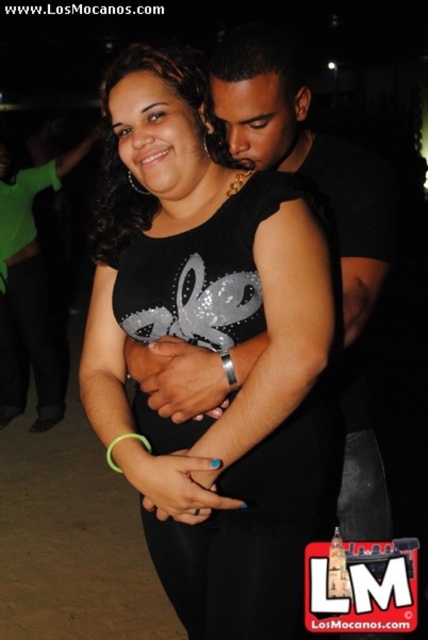
Which of these two, black sequined dress at center or black matte shirt at upper right, stands taller?

With more height is black sequined dress at center.

Can you confirm if black sequined dress at center is taller than black matte shirt at upper right?

Yes.

Between point (199, 256) and point (338, 177), which one is positioned in front?

Point (199, 256) is more forward.

Identify the location of black sequined dress at center. (210, 348).

Between black sequined dress at center and green matte shirt at left, which one is positioned higher?

Positioned higher is green matte shirt at left.

Which is in front, point (157, 522) or point (0, 243)?

Positioned in front is point (157, 522).

Who is more forward, (211, 515) or (21, 228)?

Point (211, 515) is in front.

Where is `black sequined dress at center`? The height and width of the screenshot is (640, 428). black sequined dress at center is located at coordinates (210, 348).

Between black matte shirt at upper right and green matte shirt at left, which one appears on the right side from the viewer's perspective?

black matte shirt at upper right

Can you confirm if black matte shirt at upper right is positioned above green matte shirt at left?

Actually, black matte shirt at upper right is below green matte shirt at left.

What do you see at coordinates (330, 230) in the screenshot? Image resolution: width=428 pixels, height=640 pixels. I see `black matte shirt at upper right` at bounding box center [330, 230].

Locate an element on the screen. black matte shirt at upper right is located at coordinates (330, 230).